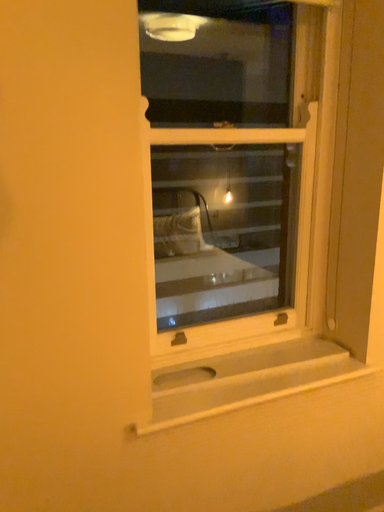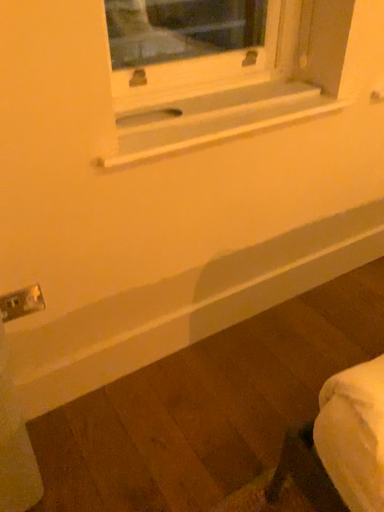
Question: Which way did the camera rotate in the video?

Choices:
 (A) rotated left
 (B) rotated right

Answer: (B)